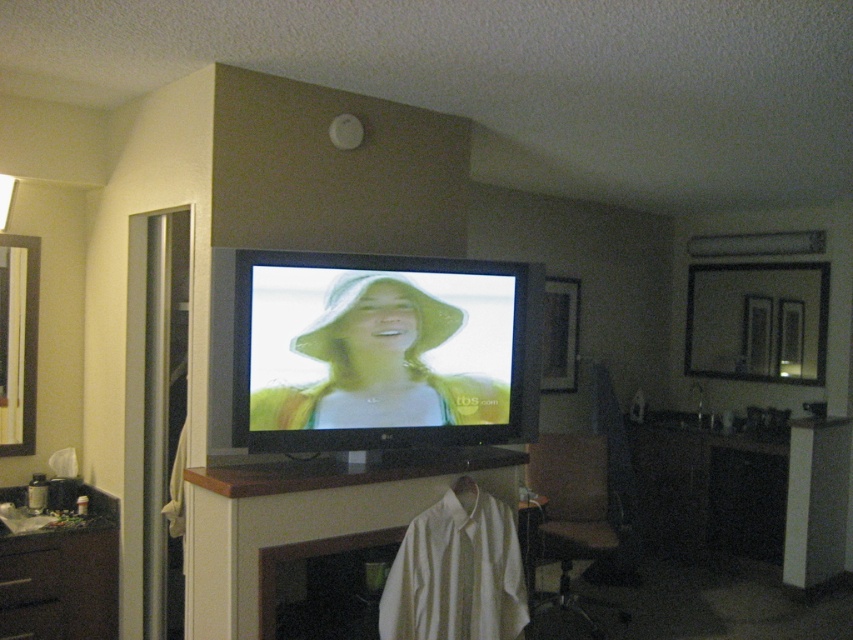
Does point (393, 285) come farther from viewer compared to point (590, 541)?

No, it is in front of (590, 541).

Which is more to the right, matte yellow hat at center or wooden seat at lower right?

Positioned to the right is wooden seat at lower right.

Identify the location of matte yellow hat at center. This screenshot has width=853, height=640. (379, 364).

Can you confirm if matte yellow hat at center is positioned to the right of dark brown wood dresser at lower left?

Indeed, matte yellow hat at center is positioned on the right side of dark brown wood dresser at lower left.

Does matte yellow hat at center appear on the left side of dark brown wood dresser at lower left?

No, matte yellow hat at center is not to the left of dark brown wood dresser at lower left.

Where is `matte yellow hat at center`? The width and height of the screenshot is (853, 640). matte yellow hat at center is located at coordinates (379, 364).

In order to click on matte yellow hat at center in this screenshot , I will do `click(379, 364)`.

Is white fabric shirt at center shorter than wooden seat at lower right?

Correct, white fabric shirt at center is not as tall as wooden seat at lower right.

Is point (416, 513) more distant than point (573, 506)?

No, it is in front of (573, 506).

This screenshot has width=853, height=640. What are the coordinates of `white fabric shirt at center` in the screenshot? It's located at (309, 518).